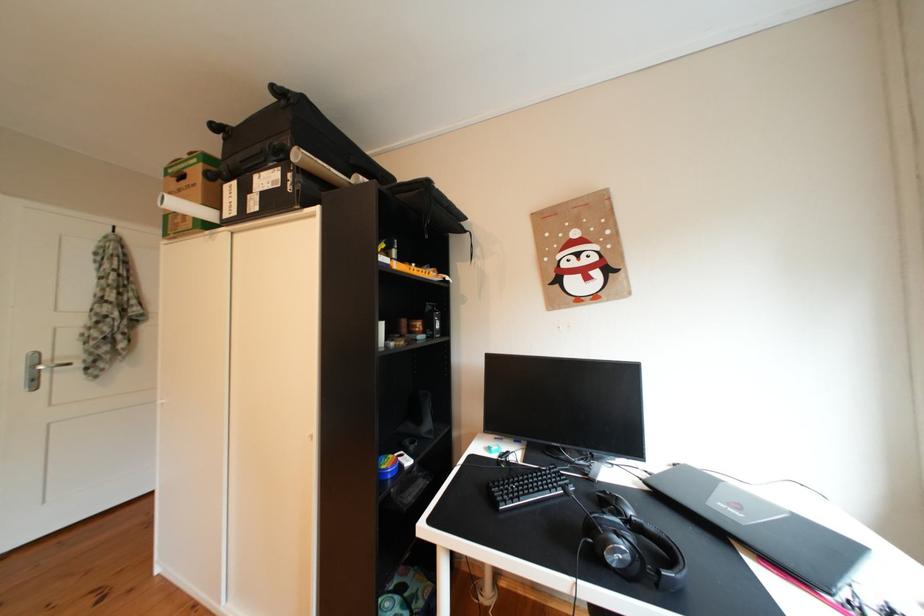
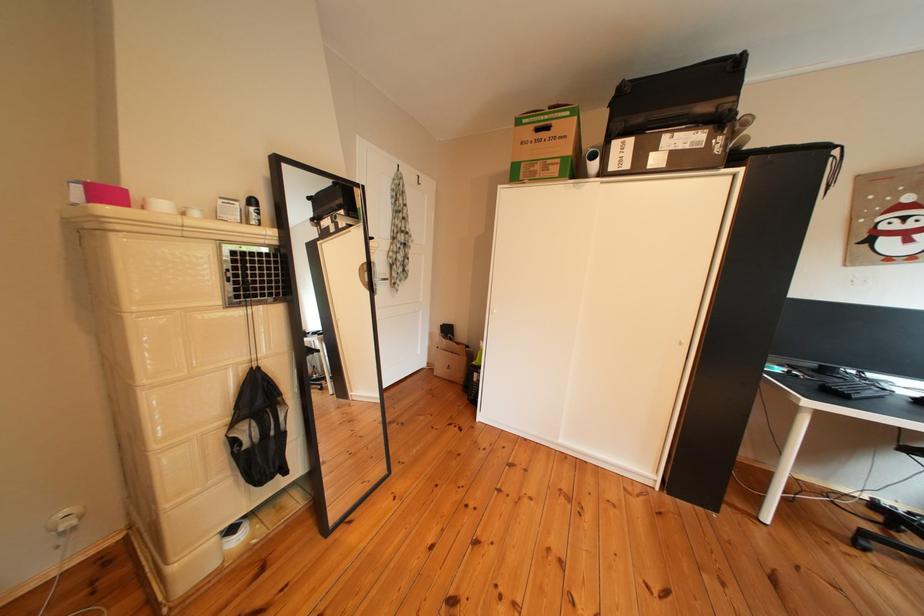
Question: Which direction would the cameraman need to move to produce the second image? Reply with the corresponding letter.

Choices:
 (A) Left
 (B) Right
 (C) Forward
 (D) Backward

Answer: (A)